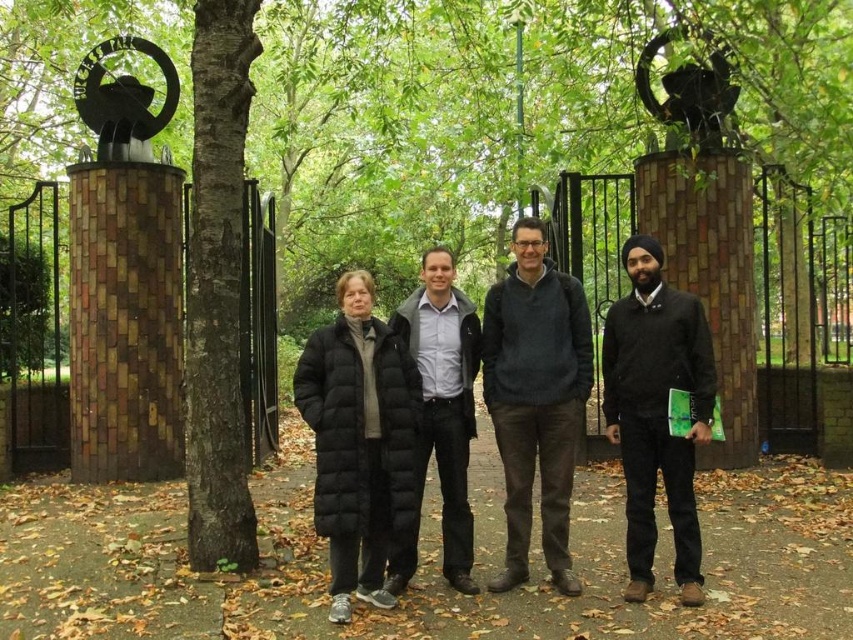
Based on the photo, which is more to the left, dark brown bark at center or dark gray sweater at center?

dark brown bark at center

What are the coordinates of `dark brown bark at center` in the screenshot? It's located at (218, 289).

Is point (225, 538) positioned in front of point (497, 432)?

Yes, point (225, 538) is closer to viewer.

Locate an element on the screen. The height and width of the screenshot is (640, 853). dark brown bark at center is located at coordinates [218, 289].

Where is `black quilted coat at center`? This screenshot has width=853, height=640. black quilted coat at center is located at coordinates (535, 397).

How distant is black quilted coat at center from black matte jacket at right?

They are 13.04 inches apart.

Describe the element at coordinates (535, 397) in the screenshot. The width and height of the screenshot is (853, 640). I see `black quilted coat at center` at that location.

This screenshot has height=640, width=853. I want to click on black quilted coat at center, so click(x=535, y=397).

Is black quilted coat at center shorter than dark gray sweater at center?

Yes.

At what (x,y) coordinates should I click in order to perform the action: click on black quilted coat at center. Please return your answer as a coordinate pair (x, y). This screenshot has width=853, height=640. Looking at the image, I should click on (535, 397).

At what (x,y) coordinates should I click in order to perform the action: click on black quilted coat at center. Please return your answer as a coordinate pair (x, y). Looking at the image, I should click on (535, 397).